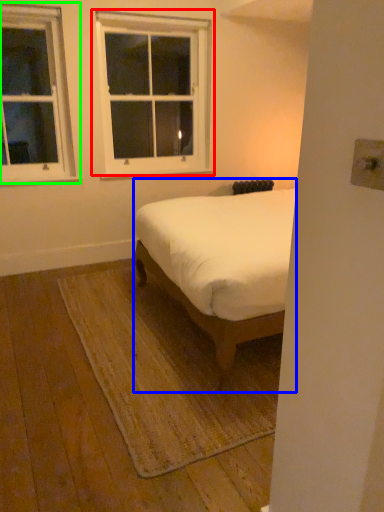
Question: Based on their relative distances, which object is nearer to window (highlighted by a red box)? Choose from bed (highlighted by a blue box) and window (highlighted by a green box).

Choices:
 (A) bed
 (B) window

Answer: (B)